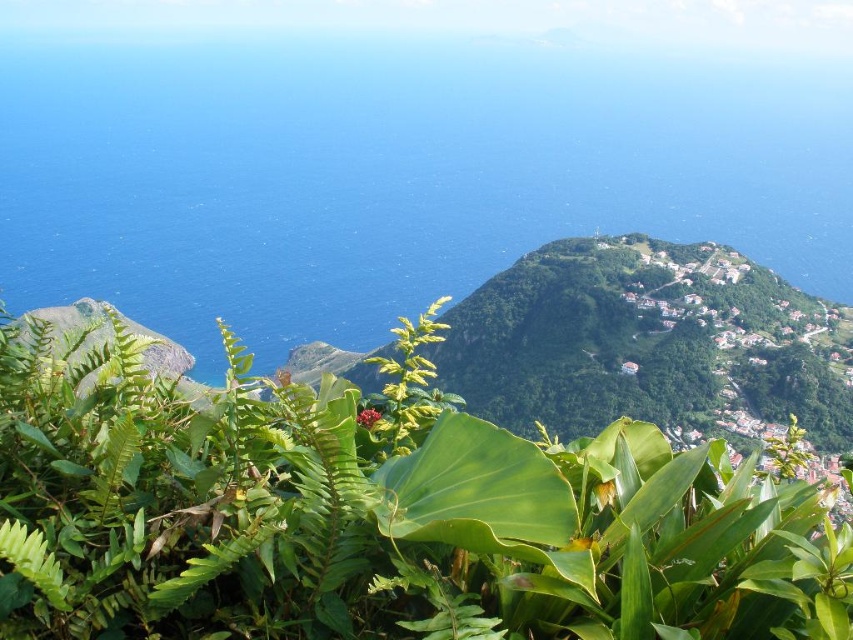
Question: Can you confirm if green leafy plant at center is bigger than blue liquid water at center?

Choices:
 (A) yes
 (B) no

Answer: (B)

Question: Is green leafy plant at center below blue liquid water at center?

Choices:
 (A) no
 (B) yes

Answer: (B)

Question: Does green leafy plant at center appear over blue liquid water at center?

Choices:
 (A) yes
 (B) no

Answer: (B)